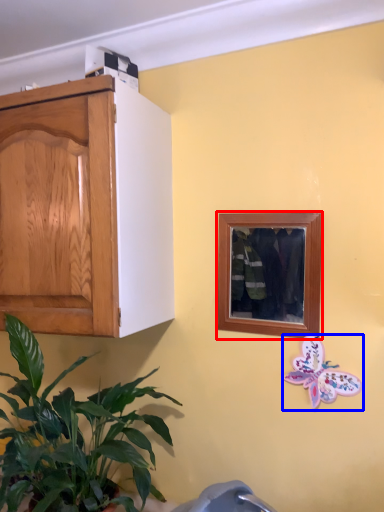
Question: Which object appears closest to the camera in this image, picture frame (highlighted by a red box) or butterfly (highlighted by a blue box)?

Choices:
 (A) picture frame
 (B) butterfly

Answer: (B)